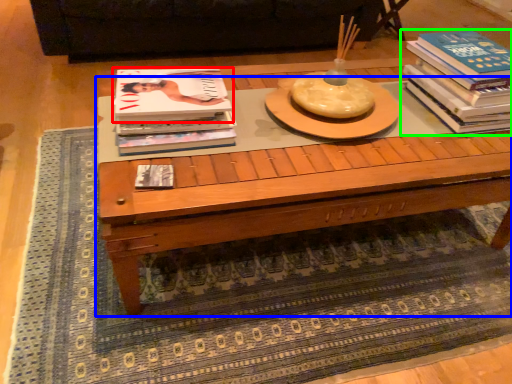
Question: Which object is positioned farthest from book (highlighted by a red box)? Select from coffee table (highlighted by a blue box) and book (highlighted by a green box).

Choices:
 (A) coffee table
 (B) book

Answer: (B)